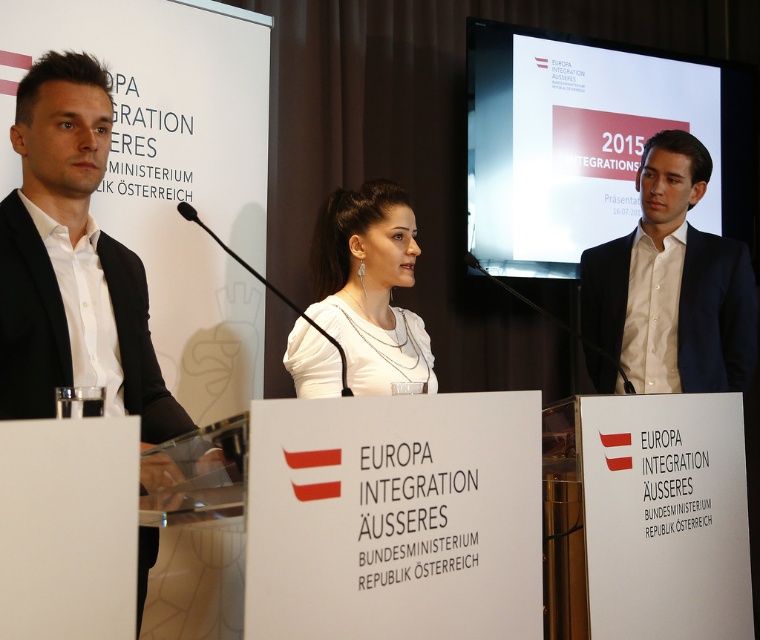
Looking at this image, you are a photographer positioned at the camera. You want to capture a closeup shot of the white shirt at center without moving the camera. Is it possible to do so with the current distance?

The white shirt at center is 2.67 meters away from the camera, so yes, it is possible to capture a closeup shot without moving the camera if the lens has sufficient zoom capability.

You are a photographer at the event and want to capture a photo of the speaker, the white shirt at center and the white matte shirt at center. Which one is on the right side of the other?

The white shirt at center is positioned on the right side of white matte shirt at center.

You are attending a press conference at the Austrian Federal Ministry of Foreign Affairs. You notice a point marked at coordinate (670, 288). What object is located at this point?

The point at coordinate (670, 288) marks the white shirt at center.